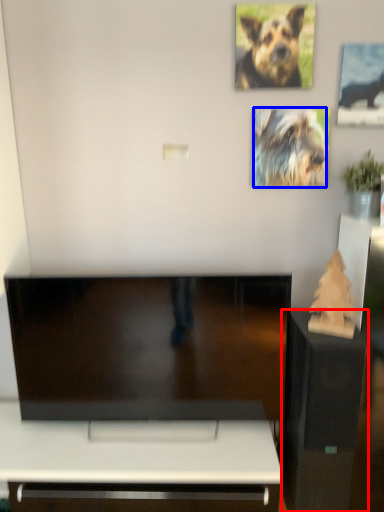
Question: Which of the following is the farthest to the observer, furniture (highlighted by a red box) or dog (highlighted by a blue box)?

Choices:
 (A) furniture
 (B) dog

Answer: (B)